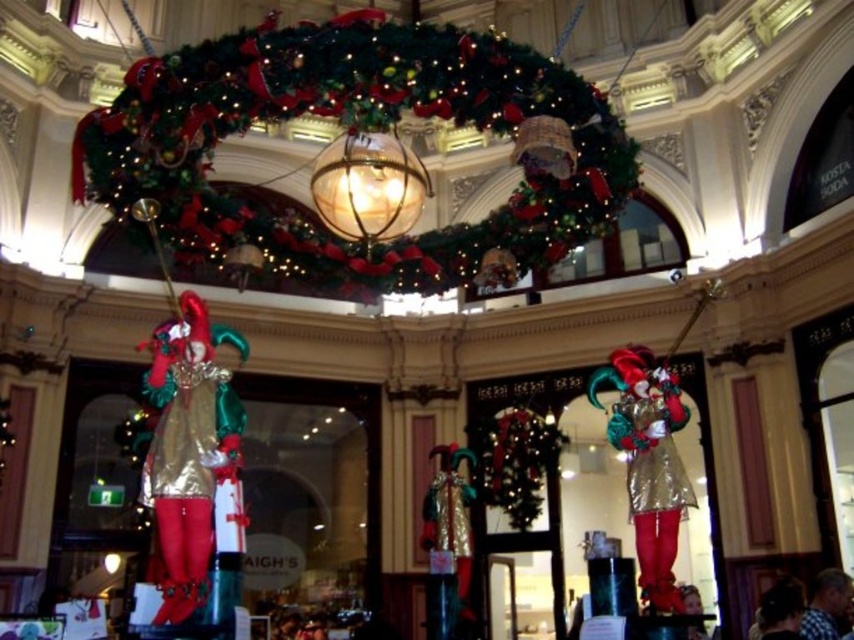
You are a visitor standing in the shopping mall and see the green velvet wreath at upper center and the metallic gold jester at left. Which object is positioned higher in the scene?

The green velvet wreath at upper center is positioned higher than the metallic gold jester at left.

You are a visitor in the mall and want to take a photo of the metallic gold jester at left and the metallic gold jester at center. Since you want them both in the frame, which jester should you position closer to the camera to ensure both are visible?

The metallic gold jester at left is positioned under the metallic gold jester at center. To capture both in the frame, you should position the camera closer to the metallic gold jester at center so that the one below it, the metallic gold jester at left, becomes visible as well.